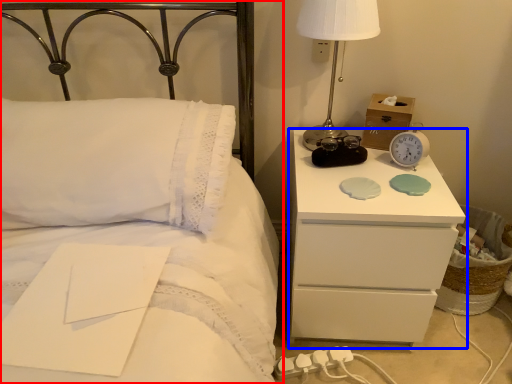
Question: Which object is closer to the camera taking this photo, bed (highlighted by a red box) or nightstand (highlighted by a blue box)?

Choices:
 (A) bed
 (B) nightstand

Answer: (A)